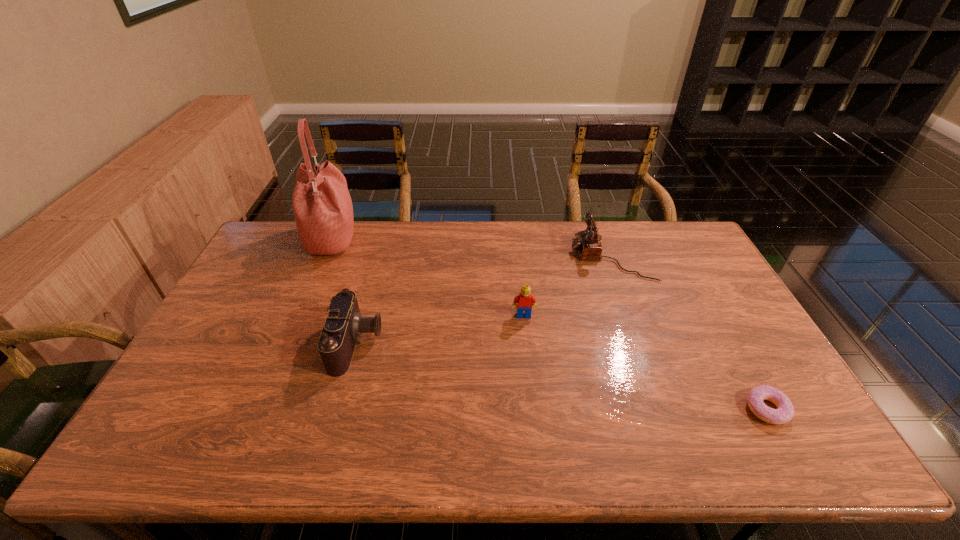
Find the location of a particular element. Image resolution: width=960 pixels, height=540 pixels. the leftmost object is located at coordinates (322, 206).

You are a GUI agent. You are given a task and a screenshot of the screen. Output one action in this format:
    pyautogui.click(x=<x>, y=<y>)
    Task: Click on the tallest object
    The height and width of the screenshot is (540, 960).
    Given the screenshot: What is the action you would take?
    pyautogui.click(x=322, y=206)

Locate an element on the screen. The image size is (960, 540). the fourth object from left to right is located at coordinates (588, 244).

Where is `camera`? The image size is (960, 540). camera is located at coordinates (344, 324).

Locate an element on the screen. Image resolution: width=960 pixels, height=540 pixels. the third object from right to left is located at coordinates (525, 301).

The height and width of the screenshot is (540, 960). What are the coordinates of `doughnut` in the screenshot? It's located at (784, 413).

At what (x,y) coordinates should I click in order to perform the action: click on the nearest object. Please return your answer as a coordinate pair (x, y). Image resolution: width=960 pixels, height=540 pixels. Looking at the image, I should click on (784, 413).

Locate an element on the screen. free space located on the right of the tallest object is located at coordinates (449, 240).

Where is `free region located 0.230m on the dial of the second object from right to left`? free region located 0.230m on the dial of the second object from right to left is located at coordinates (506, 257).

The image size is (960, 540). What are the coordinates of `vacant region located 0.150m on the dial of the second object from right to left` in the screenshot? It's located at (529, 257).